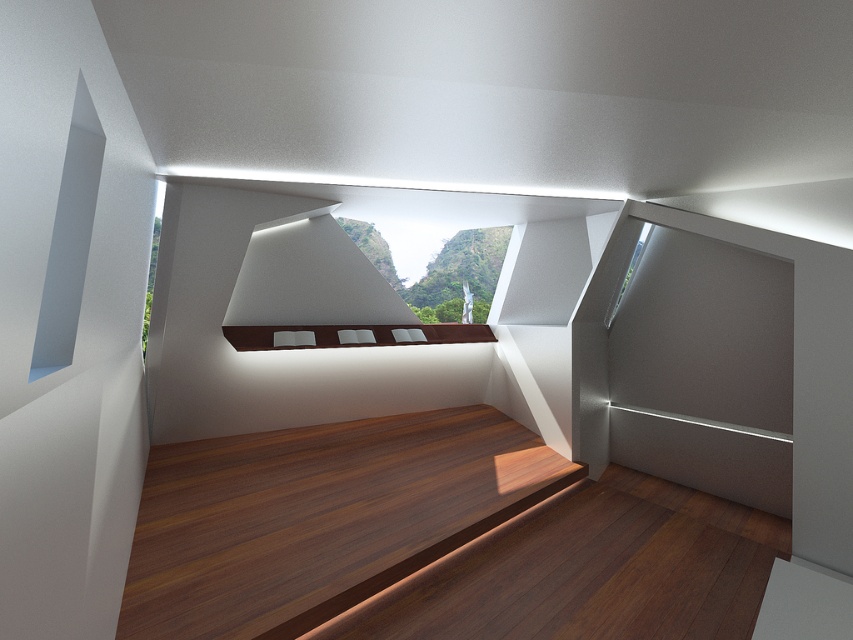
Question: Is brown matte bench at center behind clear glass window at upper right?

Choices:
 (A) no
 (B) yes

Answer: (A)

Question: Which object appears closest to the camera in this image?

Choices:
 (A) clear glass window at upper right
 (B) brown matte bench at center

Answer: (B)

Question: Does brown matte bench at center appear on the right side of clear glass window at upper right?

Choices:
 (A) no
 (B) yes

Answer: (A)

Question: Does brown matte bench at center appear on the right side of clear glass window at upper right?

Choices:
 (A) yes
 (B) no

Answer: (B)

Question: Which point appears closest to the camera in this image?

Choices:
 (A) [x=381, y=344]
 (B) [x=641, y=234]

Answer: (A)